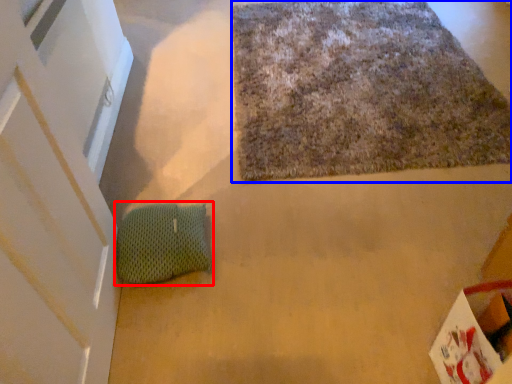
Question: Which object is closer to the camera taking this photo, bean bag chair (highlighted by a red box) or mat (highlighted by a blue box)?

Choices:
 (A) bean bag chair
 (B) mat

Answer: (A)